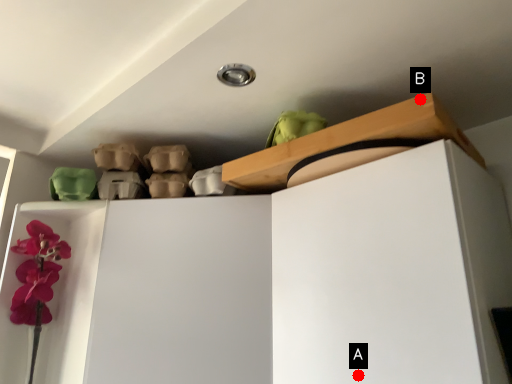
Question: Two points are circled on the image, labeled by A and B beside each circle. Which point is closer to the camera taking this photo?

Choices:
 (A) A is closer
 (B) B is closer

Answer: (A)